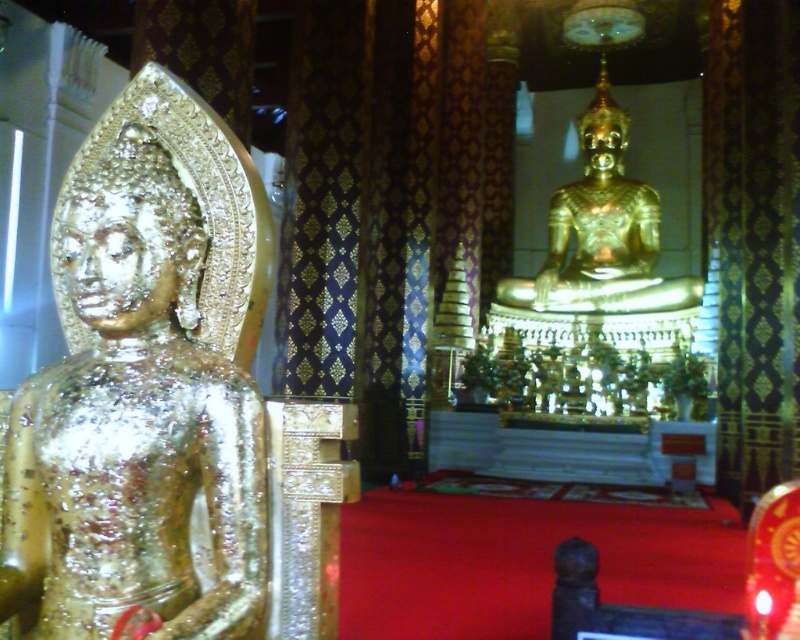
Who is taller, gold shiny statue at left or gold polished statue at center?

gold polished statue at center is taller.

At what (x,y) coordinates should I click in order to perform the action: click on gold shiny statue at left. Please return your answer as a coordinate pair (x, y). Looking at the image, I should click on (145, 387).

Where is `gold shiny statue at left`? The height and width of the screenshot is (640, 800). gold shiny statue at left is located at coordinates (145, 387).